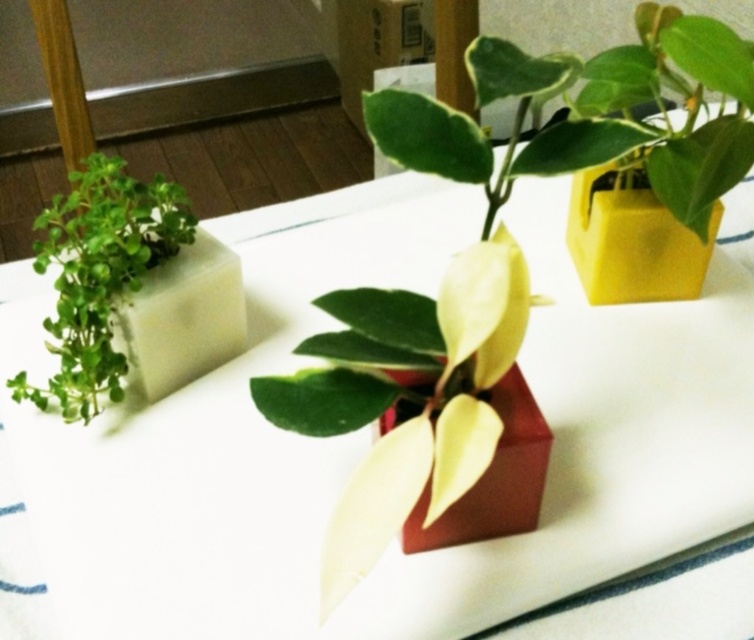
Which is in front, point (138, 442) or point (529, 404)?

Point (529, 404) is in front.

Is point (569, 532) less distant than point (498, 474)?

No.

Which is behind, point (443, 582) or point (418, 378)?

Point (418, 378)

Locate an element on the screen. This screenshot has height=640, width=754. white matte cube at left is located at coordinates (201, 442).

Can you confirm if white matte cube at left is wider than green matte plant at left?

Yes, white matte cube at left is wider than green matte plant at left.

Does point (235, 388) come closer to viewer compared to point (48, 205)?

Yes, it is.

This screenshot has height=640, width=754. Find the location of `white matte cube at left`. white matte cube at left is located at coordinates (201, 442).

The image size is (754, 640). What do you see at coordinates (100, 275) in the screenshot? I see `green matte plant at left` at bounding box center [100, 275].

Between green matte plant at left and matte red cube at center, which one appears on the right side from the viewer's perspective?

Positioned to the right is matte red cube at center.

Image resolution: width=754 pixels, height=640 pixels. What are the coordinates of `green matte plant at left` in the screenshot? It's located at (100, 275).